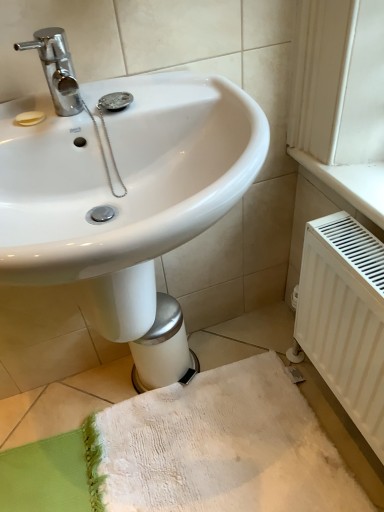
Question: From the image's perspective, is white matte radiator at lower right located above or below white textured bath towel at lower center?

Choices:
 (A) above
 (B) below

Answer: (A)

Question: Is white matte radiator at lower right wider or thinner than white textured bath towel at lower center?

Choices:
 (A) thin
 (B) wide

Answer: (A)

Question: Looking at the image, does white matte radiator at lower right seem bigger or smaller compared to white textured bath towel at lower center?

Choices:
 (A) small
 (B) big

Answer: (B)

Question: In the image, is white textured bath towel at lower center positioned in front of or behind white matte radiator at lower right?

Choices:
 (A) front
 (B) behind

Answer: (B)

Question: Based on their positions, is white textured bath towel at lower center located to the left or right of white matte radiator at lower right?

Choices:
 (A) right
 (B) left

Answer: (B)

Question: Considering the positions of point (163, 505) and point (317, 253), is point (163, 505) closer or farther from the camera than point (317, 253)?

Choices:
 (A) closer
 (B) farther

Answer: (B)

Question: In terms of height, does white textured bath towel at lower center look taller or shorter compared to white matte radiator at lower right?

Choices:
 (A) short
 (B) tall

Answer: (A)